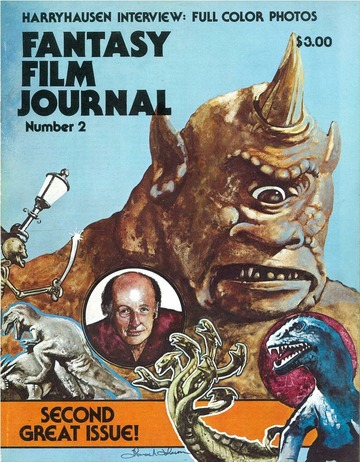
Locate an element on the screen. This screenshot has height=462, width=360. lamp is located at coordinates (48, 189).